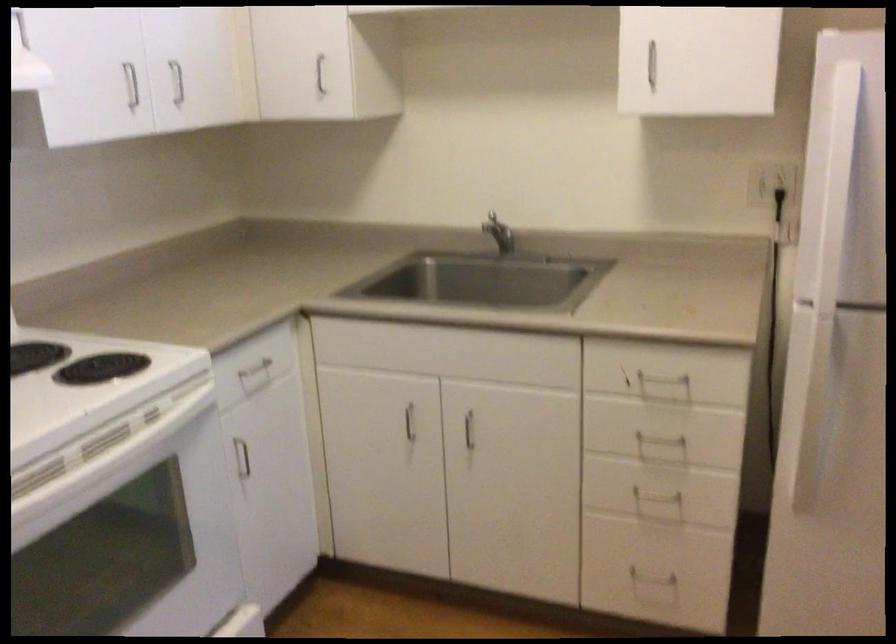
Find the location of a particular element. This screenshot has width=896, height=644. oven door handle is located at coordinates (108, 459).